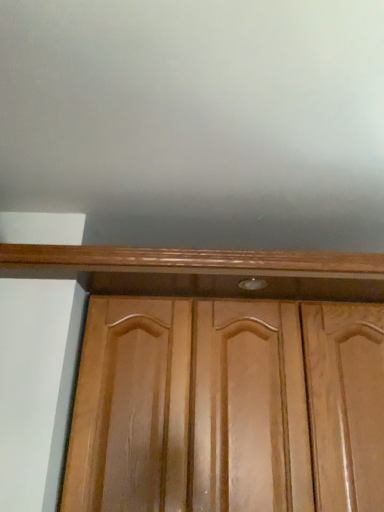
Find the location of a particular element. wooden cupboard at center is located at coordinates (203, 271).

The width and height of the screenshot is (384, 512). What do you see at coordinates (203, 271) in the screenshot?
I see `wooden cupboard at center` at bounding box center [203, 271].

This screenshot has height=512, width=384. Identify the location of wooden cupboard at center. (203, 271).